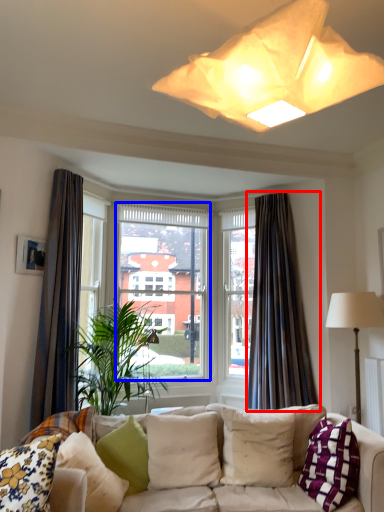
Question: Which point is closer to the camera, curtain (highlighted by a red box) or window screen (highlighted by a blue box)?

Choices:
 (A) curtain
 (B) window screen

Answer: (A)